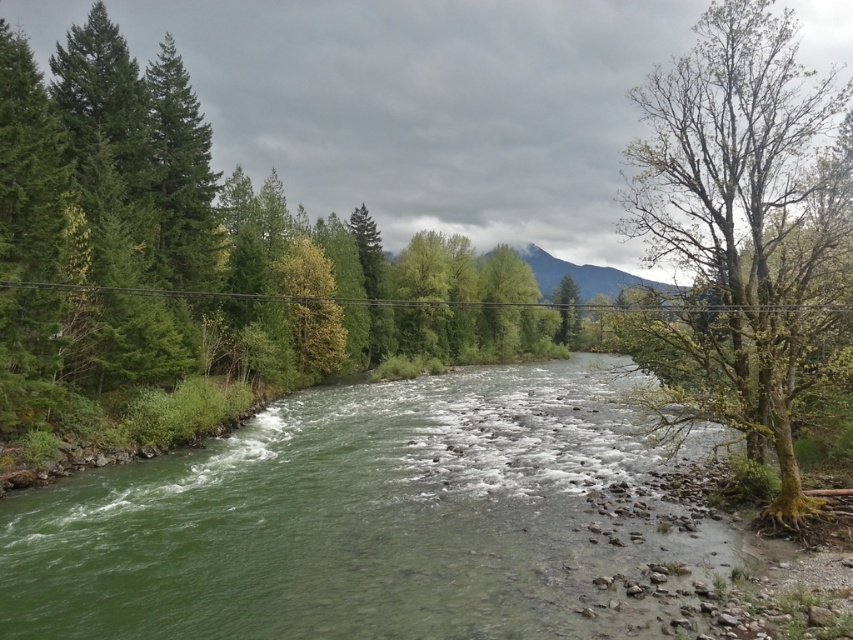
You are a hiker who wants to cross the river using a fallen log. You see the green smooth river at center and the green mossy tree at right. Which object is closer to the left bank of the river?

The green smooth river at center is closer to the left bank of the river because it is positioned to the left of the green mossy tree at right.

You are a hiker trying to determine which tree is taller between the green mossy tree at right and the green leafy tree at center. Based on the scene, which one is taller?

The green mossy tree at right is taller than the green leafy tree at center according to the description.